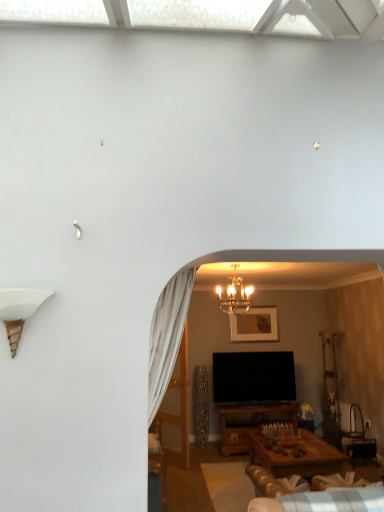
Question: From a real-world perspective, relative to plush beige couch at lower center, is gold metallic chandelier at center vertically above or below?

Choices:
 (A) above
 (B) below

Answer: (A)

Question: Considering the positions of gold metallic chandelier at center and plush beige couch at lower center in the image, is gold metallic chandelier at center wider or thinner than plush beige couch at lower center?

Choices:
 (A) thin
 (B) wide

Answer: (A)

Question: Which of these objects is positioned farthest from the translucent glass door at center?

Choices:
 (A) plush beige couch at lower center
 (B) gold-framed picture at upper center
 (C) gold metallic chandelier at center

Answer: (A)

Question: Which object is the farthest from the translucent glass door at center?

Choices:
 (A) gold metallic chandelier at center
 (B) gold-framed picture at upper center
 (C) plush beige couch at lower center

Answer: (C)